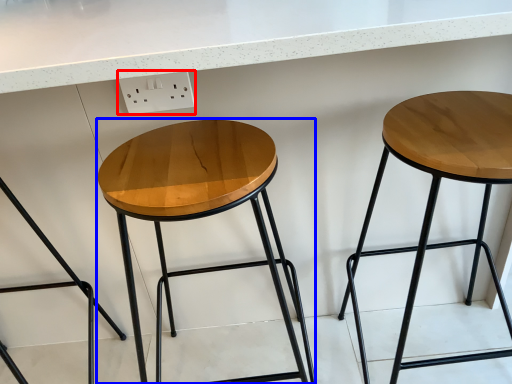
Question: Which point is further to the camera, electric outlet (highlighted by a red box) or stool (highlighted by a blue box)?

Choices:
 (A) electric outlet
 (B) stool

Answer: (A)